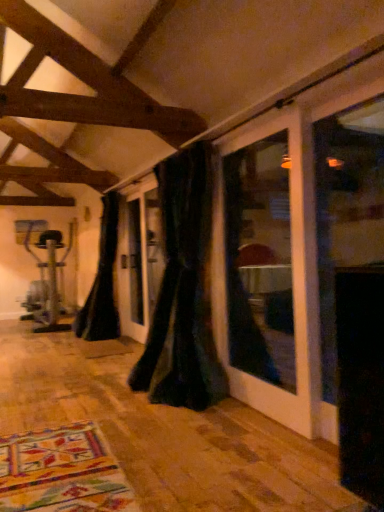
Question: From the image's perspective, is black velvet curtain at center, arranged as the first curtain when viewed from the right, on top of black velvet curtain at left, positioned as the second curtain in right-to-left order?

Choices:
 (A) no
 (B) yes

Answer: (B)

Question: Is black velvet curtain at center, which ranks as the 2th curtain in back-to-front order, looking in the opposite direction of black velvet curtain at left, the second curtain positioned from the front?

Choices:
 (A) yes
 (B) no

Answer: (B)

Question: Is black velvet curtain at center, marked as the second curtain in a left-to-right arrangement, in front of black velvet curtain at left, the second curtain positioned from the front?

Choices:
 (A) no
 (B) yes

Answer: (B)

Question: Is black velvet curtain at center, which ranks as the 2th curtain in back-to-front order, aimed at black velvet curtain at left, the second curtain positioned from the front?

Choices:
 (A) no
 (B) yes

Answer: (A)

Question: From the image's perspective, is black velvet curtain at center, arranged as the first curtain when viewed from the right, located beneath black velvet curtain at left, which is the 1th curtain in left-to-right order?

Choices:
 (A) yes
 (B) no

Answer: (B)

Question: Considering the relative positions of black velvet curtain at center, which appears as the first curtain when viewed from the front, and black velvet curtain at left, the second curtain positioned from the front, in the image provided, is black velvet curtain at center, which appears as the first curtain when viewed from the front, behind black velvet curtain at left, the second curtain positioned from the front,?

Choices:
 (A) yes
 (B) no

Answer: (B)

Question: From the image's perspective, is black velvet curtain at left, marked as the first curtain in a back-to-front arrangement, beneath black velvet curtain at center, marked as the second curtain in a left-to-right arrangement?

Choices:
 (A) no
 (B) yes

Answer: (B)

Question: Is black velvet curtain at left, positioned as the second curtain in right-to-left order, in contact with black velvet curtain at center, which ranks as the 2th curtain in back-to-front order?

Choices:
 (A) yes
 (B) no

Answer: (B)

Question: From a real-world perspective, is black velvet curtain at left, marked as the first curtain in a back-to-front arrangement, on black velvet curtain at center, marked as the second curtain in a left-to-right arrangement?

Choices:
 (A) yes
 (B) no

Answer: (A)

Question: Is black velvet curtain at left, positioned as the second curtain in right-to-left order, wider than black velvet curtain at center, marked as the second curtain in a left-to-right arrangement?

Choices:
 (A) no
 (B) yes

Answer: (B)

Question: From a real-world perspective, is black velvet curtain at left, the second curtain positioned from the front, located beneath black velvet curtain at center, which appears as the first curtain when viewed from the front?

Choices:
 (A) yes
 (B) no

Answer: (B)

Question: Is black velvet curtain at left, positioned as the second curtain in right-to-left order, positioned with its back to black velvet curtain at center, which ranks as the 2th curtain in back-to-front order?

Choices:
 (A) yes
 (B) no

Answer: (B)

Question: Is black velvet curtain at left, positioned as the second curtain in right-to-left order, taller or shorter than black velvet curtain at center, arranged as the first curtain when viewed from the right?

Choices:
 (A) tall
 (B) short

Answer: (B)